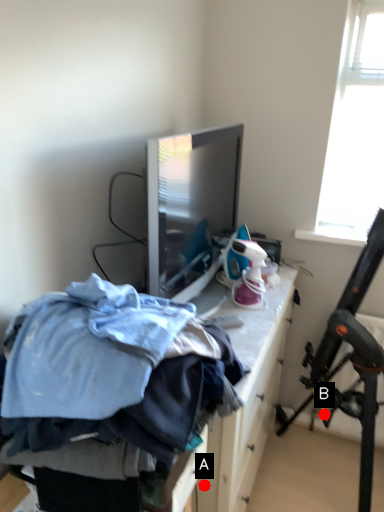
Question: Two points are circled on the image, labeled by A and B beside each circle. Which point is further to the camera?

Choices:
 (A) A is further
 (B) B is further

Answer: (B)